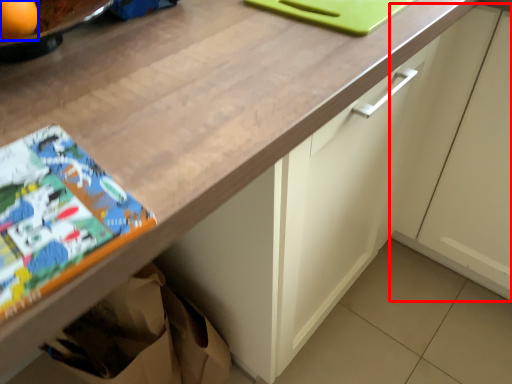
Question: Which point is closer to the camera, cabinetry (highlighted by a red box) or orange (highlighted by a blue box)?

Choices:
 (A) cabinetry
 (B) orange

Answer: (B)